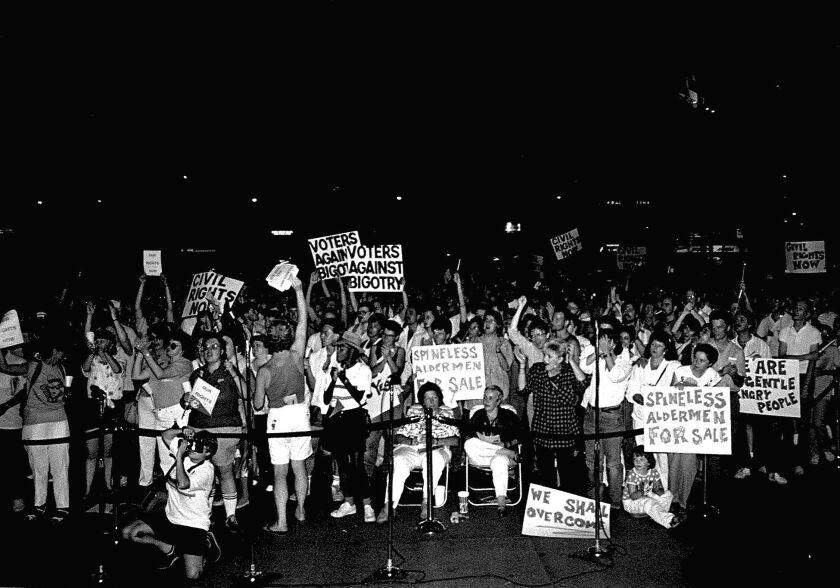
Where is `floor`? The image size is (840, 588). floor is located at coordinates (516, 557).